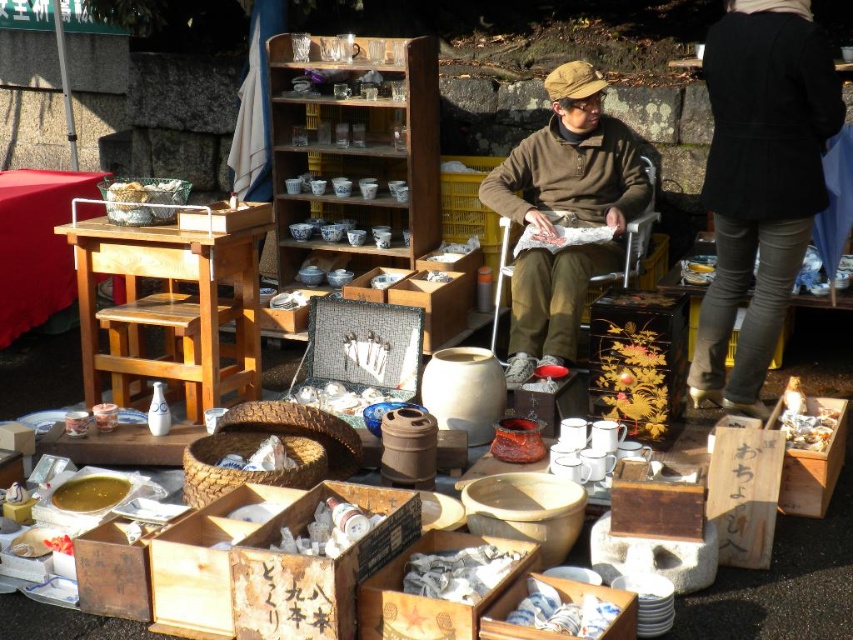
Question: Is brown woolen sweater at center wider than golden liquid at lower left?

Choices:
 (A) yes
 (B) no

Answer: (A)

Question: Does wooden table at left have a smaller size compared to white paper at center?

Choices:
 (A) no
 (B) yes

Answer: (A)

Question: Does wooden table at left appear on the right side of white glossy jar at center?

Choices:
 (A) yes
 (B) no

Answer: (B)

Question: Which object is the closest to the porcelain plates at center?

Choices:
 (A) brown woolen sweater at center
 (B) wooden table at left
 (C) golden liquid at lower left
 (D) black wool coat at upper right

Answer: (C)

Question: Which object appears closest to the camera in this image?

Choices:
 (A) golden liquid at lower left
 (B) white crumpled paper at lower right
 (C) white glossy jar at center

Answer: (C)

Question: Which object appears closest to the camera in this image?

Choices:
 (A) golden liquid at lower left
 (B) light brown wood table at left
 (C) white crumpled paper at lower right
 (D) white paper at center

Answer: (D)